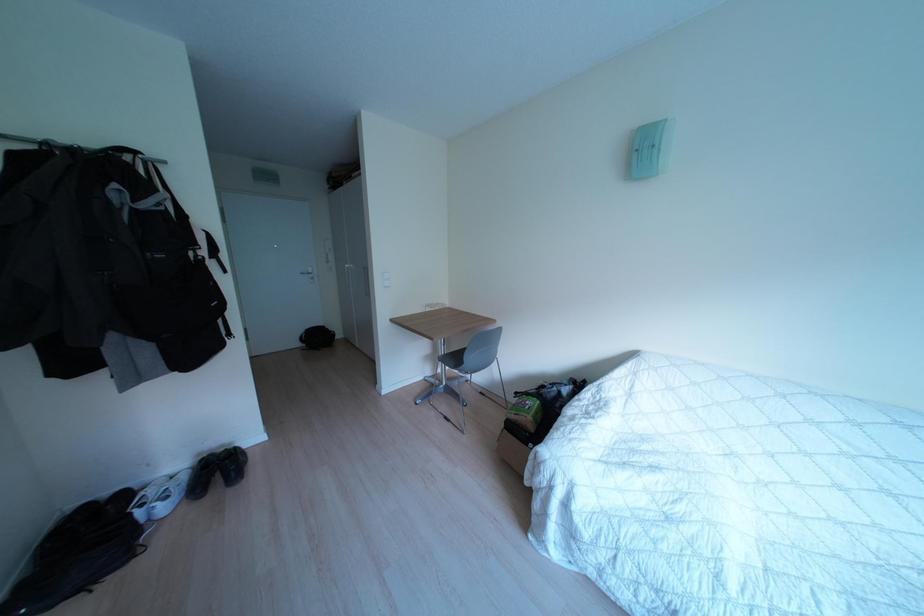
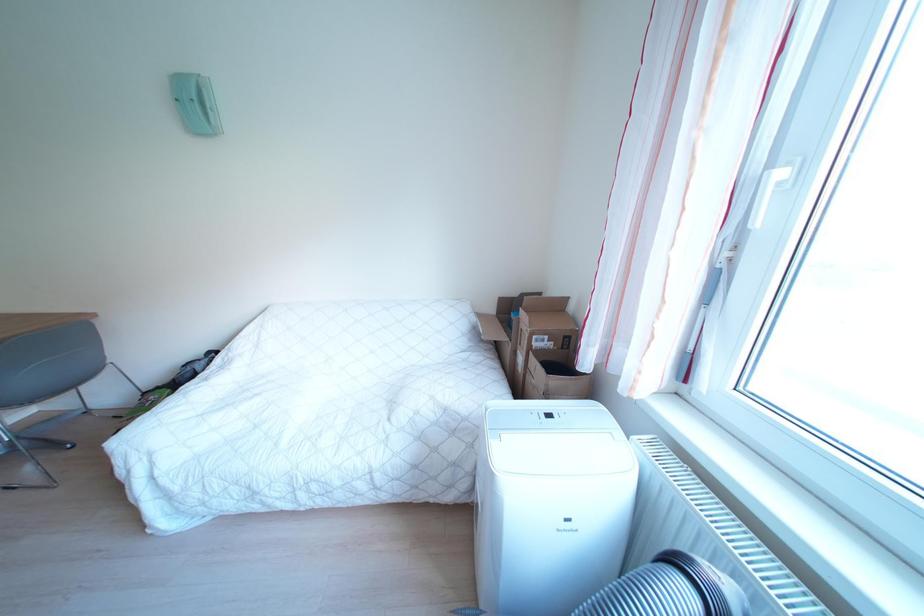
Question: The images are taken continuously from a first-person perspective. In which direction is your viewpoint rotating?

Choices:
 (A) Left
 (B) Right
 (C) Up
 (D) Down

Answer: (B)